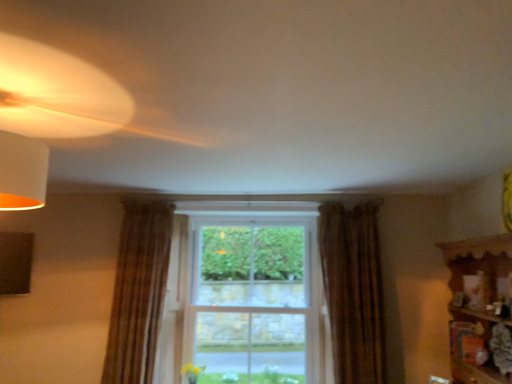
Question: Is brown textured curtain at left, which appears as the second curtain when viewed from the right, looking in the opposite direction of clear glass window at center?

Choices:
 (A) no
 (B) yes

Answer: (A)

Question: Is brown textured curtain at left, which ranks as the first curtain in left-to-right order, not inside clear glass window at center?

Choices:
 (A) no
 (B) yes

Answer: (B)

Question: Does brown textured curtain at left, which appears as the second curtain when viewed from the right, have a greater height compared to clear glass window at center?

Choices:
 (A) yes
 (B) no

Answer: (B)

Question: From the image's perspective, is brown textured curtain at left, which ranks as the first curtain in left-to-right order, below clear glass window at center?

Choices:
 (A) yes
 (B) no

Answer: (B)

Question: From a real-world perspective, is brown textured curtain at left, which ranks as the first curtain in left-to-right order, beneath clear glass window at center?

Choices:
 (A) no
 (B) yes

Answer: (A)

Question: Is brown textured curtain at left, which appears as the second curtain when viewed from the right, thinner than clear glass window at center?

Choices:
 (A) no
 (B) yes

Answer: (A)

Question: Is wooden shelf at right far away from brown textured curtain at left, which ranks as the first curtain in left-to-right order?

Choices:
 (A) no
 (B) yes

Answer: (B)

Question: Is wooden shelf at right positioned before brown textured curtain at left, which ranks as the first curtain in left-to-right order?

Choices:
 (A) yes
 (B) no

Answer: (A)

Question: From a real-world perspective, is wooden shelf at right below brown textured curtain at left, which ranks as the first curtain in left-to-right order?

Choices:
 (A) yes
 (B) no

Answer: (A)

Question: Is brown textured curtain at left, which ranks as the first curtain in left-to-right order, at the back of wooden shelf at right?

Choices:
 (A) yes
 (B) no

Answer: (B)

Question: Does wooden shelf at right have a lesser height compared to brown textured curtain at left, which ranks as the first curtain in left-to-right order?

Choices:
 (A) no
 (B) yes

Answer: (B)

Question: Is wooden shelf at right wider than brown textured curtain at left, which appears as the second curtain when viewed from the right?

Choices:
 (A) no
 (B) yes

Answer: (B)

Question: From a real-world perspective, does brown textured curtain at left, which appears as the second curtain when viewed from the right, sit lower than wooden shelf at right?

Choices:
 (A) yes
 (B) no

Answer: (B)